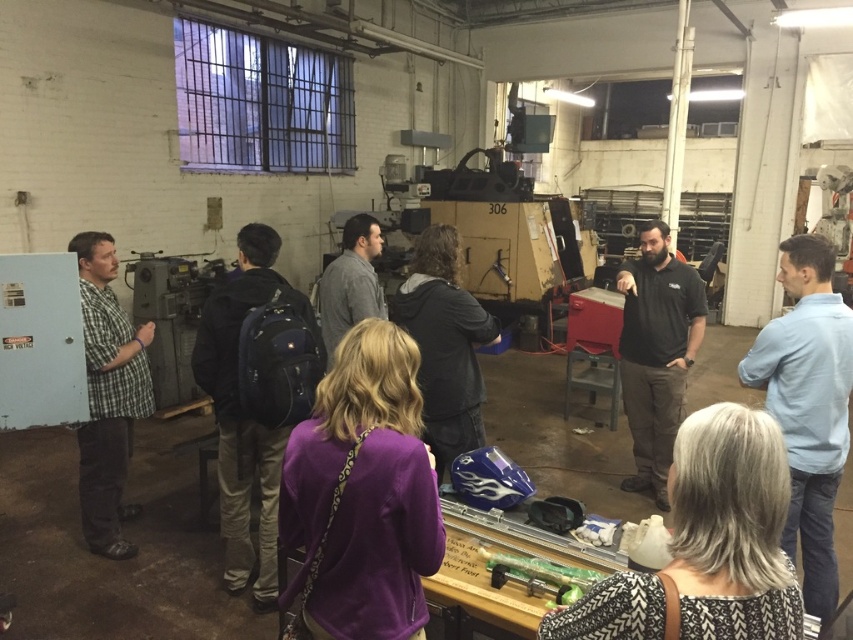
Question: Which of the following is the closest to the observer?

Choices:
 (A) (91, 308)
 (B) (427, 269)
 (C) (653, 438)

Answer: (B)

Question: Based on their relative distances, which object is farther from the light blue shirt at right?

Choices:
 (A) checkered fabric shirt at left
 (B) dark gray jacket at center

Answer: (A)

Question: Is the position of black cotton shirt at center less distant than that of dark gray jacket at center?

Choices:
 (A) yes
 (B) no

Answer: (B)

Question: Can you confirm if checkered fabric shirt at left is smaller than dark gray jacket at center?

Choices:
 (A) no
 (B) yes

Answer: (A)

Question: Is light blue shirt at right to the left of dark gray jacket at center from the viewer's perspective?

Choices:
 (A) yes
 (B) no

Answer: (B)

Question: Which point is farther to the camera?

Choices:
 (A) gray textured sweater at lower right
 (B) light blue shirt at right
 (C) purple fleece jacket at center

Answer: (B)